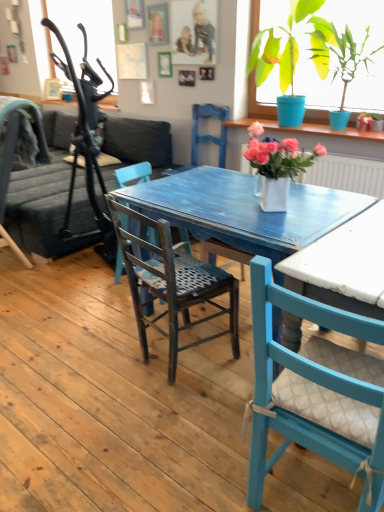
What do you see at coordinates (48, 210) in the screenshot? I see `dark gray fabric couch at left` at bounding box center [48, 210].

This screenshot has width=384, height=512. What do you see at coordinates (13, 156) in the screenshot?
I see `dark blue fabric chair at left, which ranks as the first chair in left-to-right order` at bounding box center [13, 156].

Identify the location of white ceramic vase at center, marked as the second houseplant in a back-to-front arrangement. (277, 166).

This screenshot has width=384, height=512. What do you see at coordinates (316, 391) in the screenshot?
I see `matte blue chair with cushion at center, placed as the 3th chair when sorted from left to right` at bounding box center [316, 391].

This screenshot has width=384, height=512. Find the location of `wooden chair with patterned seat cushion at center, which is counted as the 2th chair, starting from the right`. wooden chair with patterned seat cushion at center, which is counted as the 2th chair, starting from the right is located at coordinates (171, 284).

The height and width of the screenshot is (512, 384). I want to click on green glossy plant at upper right, positioned as the first houseplant in right-to-left order, so click(258, 103).

How much space does green glossy plant at upper right, positioned as the 2th houseplant in front-to-back order, occupy horizontally?

19.07 inches.

The image size is (384, 512). Identify the location of dark gray fabric couch at left. (48, 210).

In the scene shown: Who is smaller, matte blue chair with cushion at center, placed as the 3th chair when sorted from left to right, or green glossy plant at upper right, placed as the 2th houseplant when sorted from left to right?

Smaller between the two is matte blue chair with cushion at center, placed as the 3th chair when sorted from left to right.

In terms of height, does matte blue chair with cushion at center, the first chair positioned from the right, look taller or shorter compared to green glossy plant at upper right, positioned as the first houseplant in right-to-left order?

Clearly, matte blue chair with cushion at center, the first chair positioned from the right, is taller compared to green glossy plant at upper right, positioned as the first houseplant in right-to-left order.

Is blue wooden chair at center to the left of green glossy plant at upper right, arranged as the first houseplant when viewed from the top, from the viewer's perspective?

Indeed, blue wooden chair at center is positioned on the left side of green glossy plant at upper right, arranged as the first houseplant when viewed from the top.

Can you confirm if blue wooden chair at center is shorter than green glossy plant at upper right, arranged as the first houseplant when viewed from the top?

Yes, blue wooden chair at center is shorter than green glossy plant at upper right, arranged as the first houseplant when viewed from the top.

The image size is (384, 512). I want to click on armchair that appears on the left of green glossy plant at upper right, the second houseplant when ordered from bottom to top, so click(x=209, y=135).

Are blue wooden chair at center and green glossy plant at upper right, arranged as the first houseplant when viewed from the top, beside each other?

No, blue wooden chair at center is not next to green glossy plant at upper right, arranged as the first houseplant when viewed from the top.

Considering their positions, is dark blue fabric chair at left, which ranks as the first chair in left-to-right order, located in front of or behind dark gray fabric couch at left?

Visually, dark blue fabric chair at left, which ranks as the first chair in left-to-right order, is located in front of dark gray fabric couch at left.

Is point (11, 130) positioned behind point (154, 139)?

No, (11, 130) is closer to viewer.

Based on the photo, from a real-world perspective, is dark blue fabric chair at left, the third chair viewed from the front, on dark gray fabric couch at left?

Yes, from a real-world perspective, dark blue fabric chair at left, the third chair viewed from the front, is on top of dark gray fabric couch at left.

From the image's perspective, is dark blue fabric chair at left, the third chair viewed from the front, above or below dark gray fabric couch at left?

Clearly, from the image's perspective, dark blue fabric chair at left, the third chair viewed from the front, is below dark gray fabric couch at left.

Are blue wooden chair at center and dark gray fabric couch at left making contact?

No.

From the image's perspective, is blue wooden chair at center beneath dark gray fabric couch at left?

Incorrect, from the image's perspective, blue wooden chair at center is higher than dark gray fabric couch at left.

In the scene shown: Which object is thinner, blue wooden chair at center or dark gray fabric couch at left?

With smaller width is blue wooden chair at center.

Is blue wooden chair at center to the right of dark gray fabric couch at left from the viewer's perspective?

Correct, you'll find blue wooden chair at center to the right of dark gray fabric couch at left.

Is green glossy plant at upper right, positioned as the first houseplant in right-to-left order, positioned far away from blue wooden chair at center?

They are positioned close to each other.

Is green glossy plant at upper right, arranged as the first houseplant when viewed from the top, oriented away from blue wooden chair at center?

That's not correct — green glossy plant at upper right, arranged as the first houseplant when viewed from the top, is not looking away from blue wooden chair at center.

Between green glossy plant at upper right, the 1th houseplant when ordered from back to front, and blue wooden chair at center, which one has larger size?

With larger size is green glossy plant at upper right, the 1th houseplant when ordered from back to front.

Considering the positions of point (257, 0) and point (197, 158), is point (257, 0) closer or farther from the camera than point (197, 158)?

Point (257, 0).

Between matte blue chair with cushion at center, the 3th chair when ordered from back to front, and dark gray fabric couch at left, which one has smaller size?

matte blue chair with cushion at center, the 3th chair when ordered from back to front.

Is matte blue chair with cushion at center, the first chair positioned from the right, positioned in front of dark gray fabric couch at left?

Yes.

Would you consider matte blue chair with cushion at center, which is the first chair from front to back, to be distant from dark gray fabric couch at left?

Yes, matte blue chair with cushion at center, which is the first chair from front to back, is far from dark gray fabric couch at left.

Is wooden chair with patterned seat cushion at center, which is counted as the 2th chair, starting from the right, spatially inside dark blue fabric chair at left, acting as the 3th chair starting from the right, or outside of it?

wooden chair with patterned seat cushion at center, which is counted as the 2th chair, starting from the right, is spatially situated outside dark blue fabric chair at left, acting as the 3th chair starting from the right.

I want to click on chair that is on the left side of wooden chair with patterned seat cushion at center, which ranks as the second chair in back-to-front order, so click(13, 156).

Considering the relative positions of wooden chair with patterned seat cushion at center, which is counted as the 2th chair, starting from the right, and dark blue fabric chair at left, acting as the 3th chair starting from the right, in the image provided, is wooden chair with patterned seat cushion at center, which is counted as the 2th chair, starting from the right, to the left or to the right of dark blue fabric chair at left, acting as the 3th chair starting from the right,?

Based on their positions, wooden chair with patterned seat cushion at center, which is counted as the 2th chair, starting from the right, is located to the right of dark blue fabric chair at left, acting as the 3th chair starting from the right.

Which is farther, (119, 207) or (5, 236)?

The point (5, 236) is farther.

From the image's perspective, count 3rd chairs downward from the green glossy plant at upper right, positioned as the first houseplant in right-to-left order, and point to it. Please provide its 2D coordinates.

[(316, 391)]

Find the location of `houseplant above the blue wooden chair at center (from the image's perspective)`. houseplant above the blue wooden chair at center (from the image's perspective) is located at coordinates (258, 103).

Based on their spatial positions, is dark blue fabric chair at left, acting as the 3th chair starting from the right, or blue wooden chair at center closer to dark gray fabric couch at left?

Among the two, dark blue fabric chair at left, acting as the 3th chair starting from the right, is located nearer to dark gray fabric couch at left.

Estimate the real-world distances between objects in this image. Which object is closer to green glossy plant at upper right, the 1th houseplant when ordered from back to front, dark blue fabric chair at left, the first chair positioned from the back, or dark gray fabric couch at left?

dark gray fabric couch at left is positioned closer to the anchor green glossy plant at upper right, the 1th houseplant when ordered from back to front.

Looking at the image, which one is located further to matte blue chair with cushion at center, the first chair positioned from the right, dark blue fabric chair at left, which ranks as the first chair in left-to-right order, or white ceramic vase at center, marked as the second houseplant in a back-to-front arrangement?

dark blue fabric chair at left, which ranks as the first chair in left-to-right order, lies further to matte blue chair with cushion at center, the first chair positioned from the right, than the other object.

Estimate the real-world distances between objects in this image. Which object is further from dark blue fabric chair at left, the first chair positioned from the back, matte blue chair with cushion at center, the 3th chair when ordered from back to front, or green glossy plant at upper right, the 1th houseplant when ordered from back to front?

Based on the image, matte blue chair with cushion at center, the 3th chair when ordered from back to front, appears to be further to dark blue fabric chair at left, the first chair positioned from the back.

When comparing their distances from dark gray fabric couch at left, does matte blue chair with cushion at center, which is the first chair from front to back, or blue wooden chair at center seem further?

matte blue chair with cushion at center, which is the first chair from front to back, is further to dark gray fabric couch at left.

Considering their positions, is dark gray fabric couch at left positioned further to matte blue chair with cushion at center, placed as the 3th chair when sorted from left to right, than wooden chair with patterned seat cushion at center, the 2th chair positioned from the left?

Based on the image, dark gray fabric couch at left appears to be further to matte blue chair with cushion at center, placed as the 3th chair when sorted from left to right.

Based on their spatial positions, is wooden chair with patterned seat cushion at center, which is counted as the 2th chair, starting from the right, or green glossy plant at upper right, positioned as the 2th houseplant in front-to-back order, closer to white ceramic vase at center, marked as the second houseplant in a back-to-front arrangement?

wooden chair with patterned seat cushion at center, which is counted as the 2th chair, starting from the right, is positioned closer to the anchor white ceramic vase at center, marked as the second houseplant in a back-to-front arrangement.

Which object lies nearer to the anchor point wooden chair with patterned seat cushion at center, the 2th chair positioned from the left, blue wooden chair at center or dark gray fabric couch at left?

The object closer to wooden chair with patterned seat cushion at center, the 2th chair positioned from the left, is dark gray fabric couch at left.

This screenshot has height=512, width=384. Identify the location of studio couch between dark blue fabric chair at left, acting as the 3th chair starting from the right, and blue wooden chair at center. (48, 210).

Where is `houseplant located between white ceramic vase at center, which ranks as the 2th houseplant in top-to-bottom order, and blue wooden chair at center in the depth direction`? The image size is (384, 512). houseplant located between white ceramic vase at center, which ranks as the 2th houseplant in top-to-bottom order, and blue wooden chair at center in the depth direction is located at coordinates (258, 103).

You are a GUI agent. You are given a task and a screenshot of the screen. Output one action in this format:
    pyautogui.click(x=<x>, y=<y>)
    Task: Click on the houseplant between dark blue fabric chair at left, acting as the 3th chair starting from the right, and green glossy plant at upper right, the second houseplant when ordered from bottom to top, in the horizontal direction
    This screenshot has height=512, width=384.
    Given the screenshot: What is the action you would take?
    pyautogui.click(x=277, y=166)

At what (x,y) coordinates should I click in order to perform the action: click on chair positioned between matte blue chair with cushion at center, the first chair positioned from the right, and white ceramic vase at center, the first houseplant from the front, from near to far. Please return your answer as a coordinate pair (x, y). Looking at the image, I should click on (171, 284).